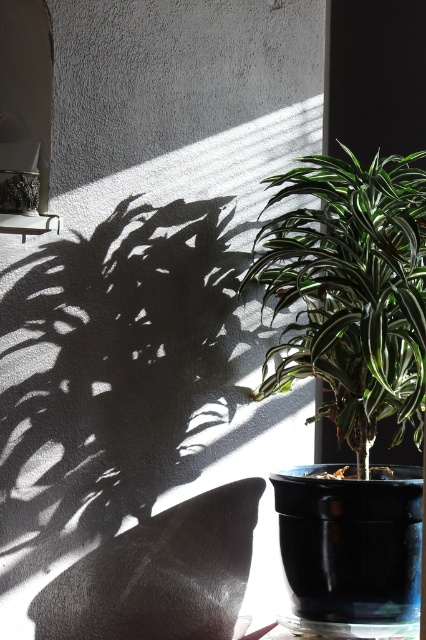
Question: Among these objects, which one is farthest from the camera?

Choices:
 (A) green glossy plant at center
 (B) metallic frame at upper left

Answer: (B)

Question: Is green glossy plant at center in front of metallic frame at upper left?

Choices:
 (A) yes
 (B) no

Answer: (A)

Question: Is green glossy plant at center to the right of metallic frame at upper left from the viewer's perspective?

Choices:
 (A) yes
 (B) no

Answer: (A)

Question: Which point is farther to the camera?

Choices:
 (A) (31, 65)
 (B) (365, 371)

Answer: (B)

Question: Among these points, which one is farthest from the camera?

Choices:
 (A) (0, 6)
 (B) (365, 316)

Answer: (A)

Question: Does green glossy plant at center appear on the right side of metallic frame at upper left?

Choices:
 (A) no
 (B) yes

Answer: (B)